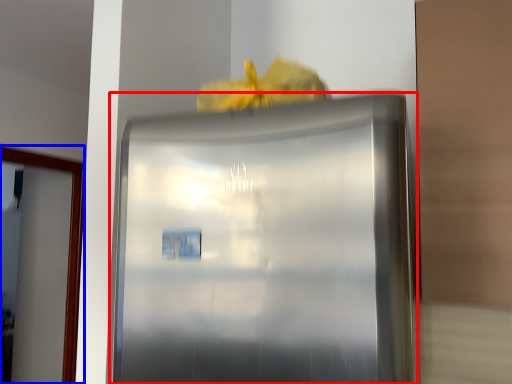
Question: Which object is further to the camera taking this photo, refrigerator (highlighted by a red box) or glass door (highlighted by a blue box)?

Choices:
 (A) refrigerator
 (B) glass door

Answer: (B)